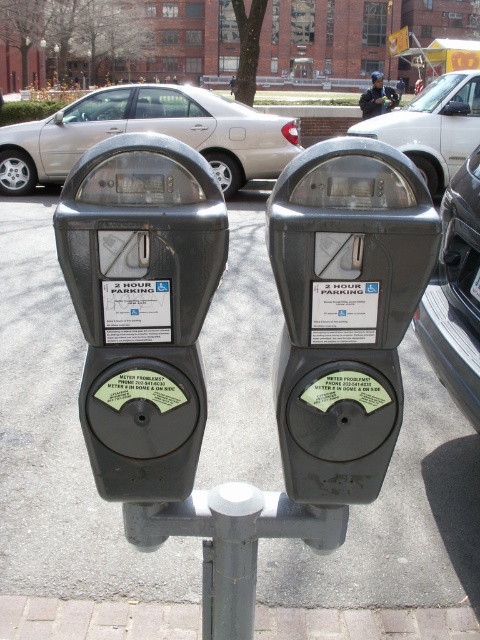
You are a delivery person trying to park your bike between the metallic gray parking meter at center and the dark blue uniform at center. Can your bike fit in the space between them?

The metallic gray parking meter at center is narrower than the dark blue uniform at center, so the space between them may be sufficient for your bike depending on the bike width. However, the exact width isn not specified, so it is recommended to measure the space before parking.

You are standing at the point marked by the coordinate (142, 307). Which object are you directly in front of?

You are directly in front of the metallic gray parking meter at center, as the point (142, 307) represents its location.

You are a delivery person trying to park your 6 feet tall delivery van next to the gray asphalt at center. Can you safely park your van there without blocking the silver metallic sedan at left?

The gray asphalt at center has a lesser height compared to silver metallic sedan at left, so the van can park there safely as the asphalt is lower and won